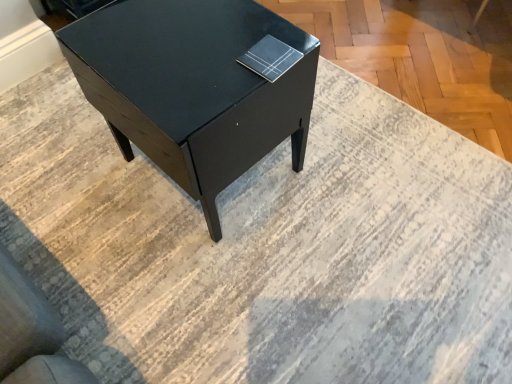
Locate an element on the screen. vacant space behind matte black book at upper right is located at coordinates (246, 25).